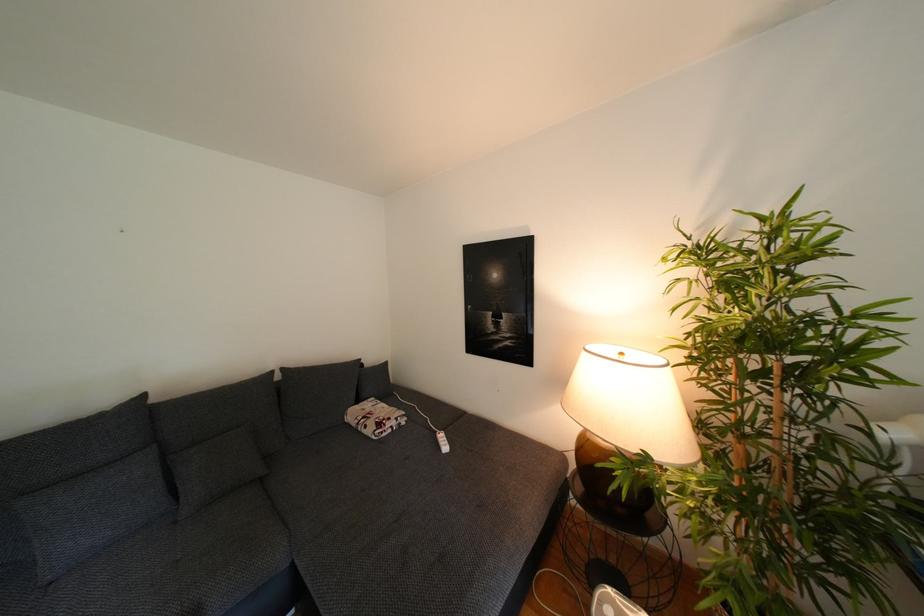
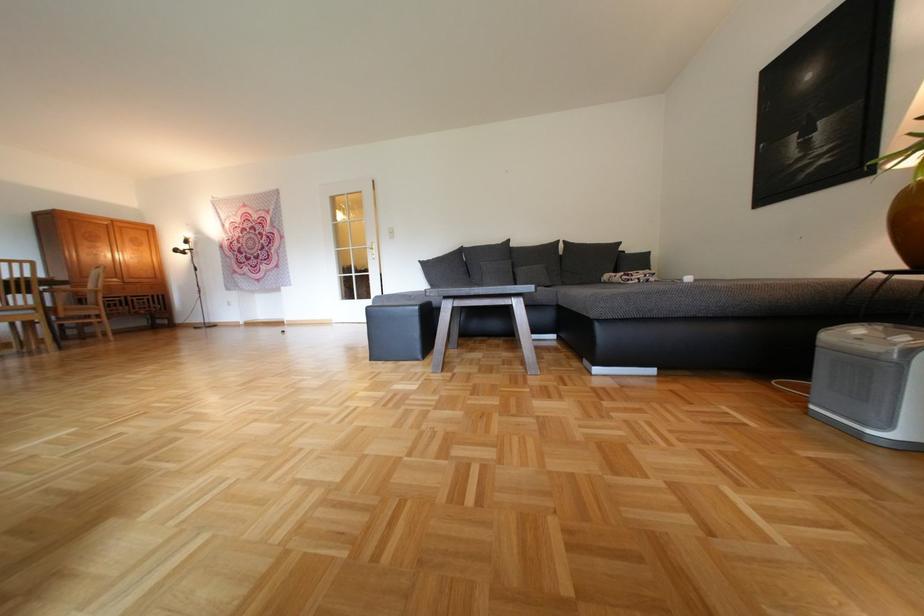
The point at (411, 424) is marked in the first image. Where is the corresponding point in the second image?

(661, 280)